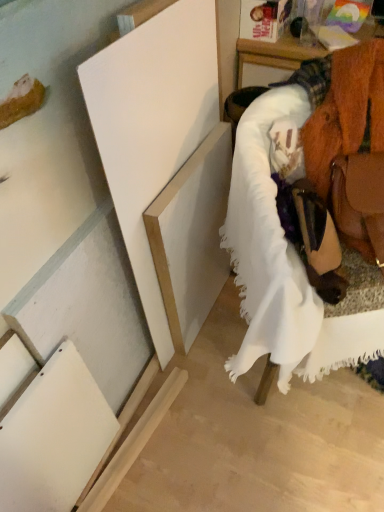
What is the approximate height of white woven laundry at right?

It is 27.47 inches.

At what (x,y) coordinates should I click in order to perform the action: click on white woven laundry at right. Please return your answer as a coordinate pair (x, y). Looking at the image, I should click on (322, 199).

What do you see at coordinates (322, 199) in the screenshot?
I see `white woven laundry at right` at bounding box center [322, 199].

Find the location of a particular element. Image resolution: width=384 pixels, height=512 pixels. white woven laundry at right is located at coordinates (322, 199).